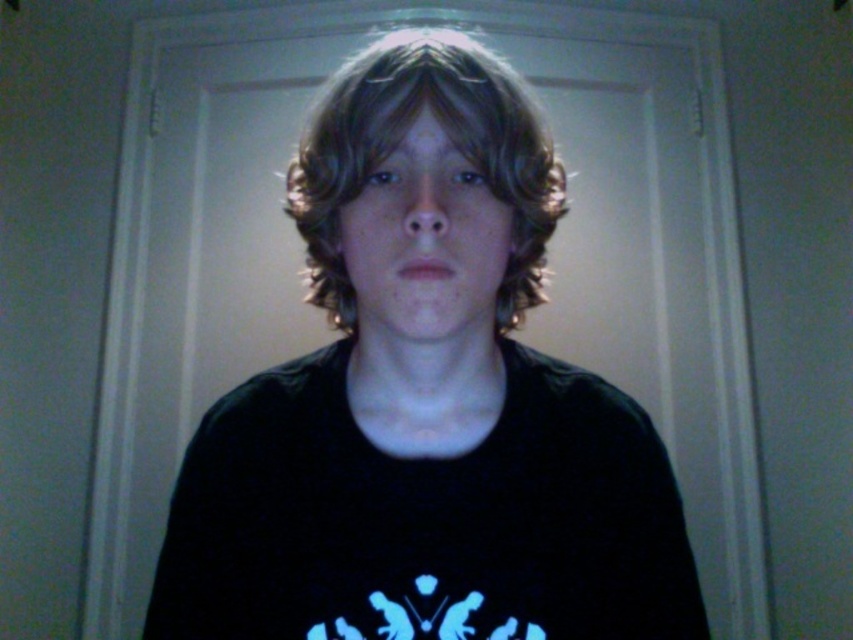
You are a photographer setting up for a portrait shoot. You want to ensure that the black matte shirt at center and the brown wavy hair at center are both in focus. If your camera has a depth of field that can cover objects within 1.5 meters of each other, will both subjects be in focus?

The distance between the black matte shirt at center and the brown wavy hair at center is 1.36 meters, which is within the 1.5 meters depth of field range. Therefore, both subjects will be in focus.